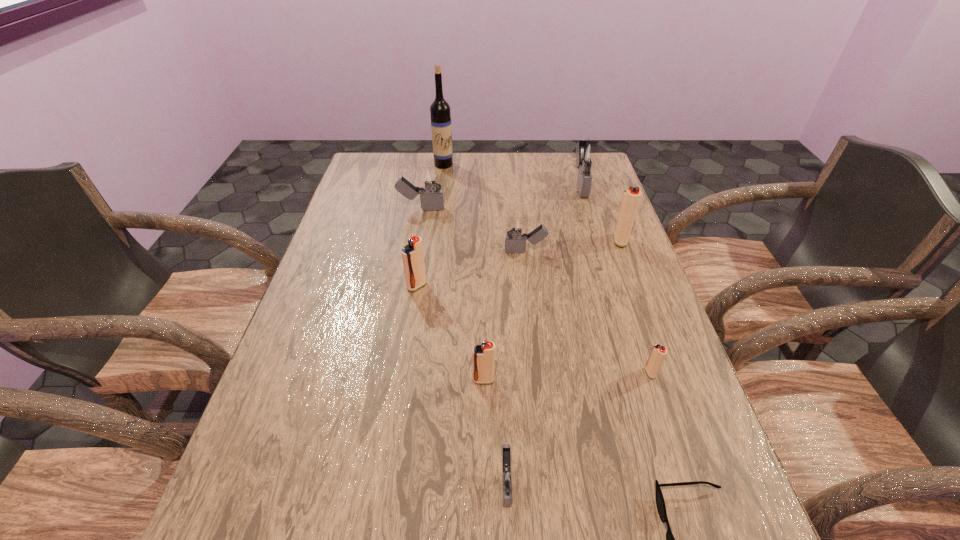
Image resolution: width=960 pixels, height=540 pixels. What are the coordinates of `the third biggest gray igniter` in the screenshot? It's located at (515, 226).

Locate an element on the screen. the third biggest red igniter is located at coordinates (483, 356).

This screenshot has height=540, width=960. I want to click on the smallest red igniter, so click(658, 353).

This screenshot has height=540, width=960. I want to click on the smallest gray igniter, so click(x=505, y=477).

The width and height of the screenshot is (960, 540). I want to click on the nearest igniter, so [505, 477].

Identify the location of vacant space located on the label of the farthest object. Image resolution: width=960 pixels, height=540 pixels. [x=438, y=215].

Where is `vacant region located on the front of the farthest red igniter`? This screenshot has height=540, width=960. vacant region located on the front of the farthest red igniter is located at coordinates (631, 269).

Identify the location of free space located on the front of the farthest gray igniter. (590, 217).

You are a GUI agent. You are given a task and a screenshot of the screen. Output one action in this format:
    pyautogui.click(x=<x>, y=<y>)
    Task: Click on the vacant position located on the left of the third smallest red igniter
    
    Given the screenshot: What is the action you would take?
    pyautogui.click(x=333, y=286)

Identify the location of free spot located on the right of the second farthest gray igniter. (568, 208).